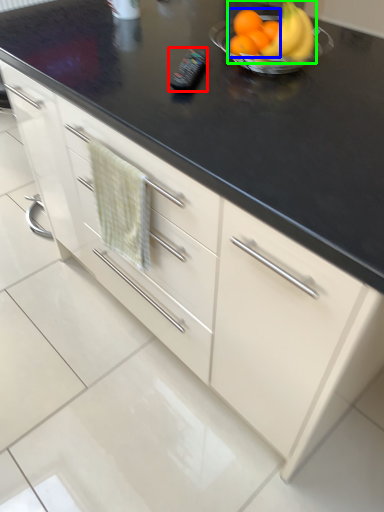
Question: Considering the real-world distances, which object is closest to appliance (highlighted by a red box)? citrus fruit (highlighted by a blue box) or grapefruit (highlighted by a green box).

Choices:
 (A) citrus fruit
 (B) grapefruit

Answer: (A)